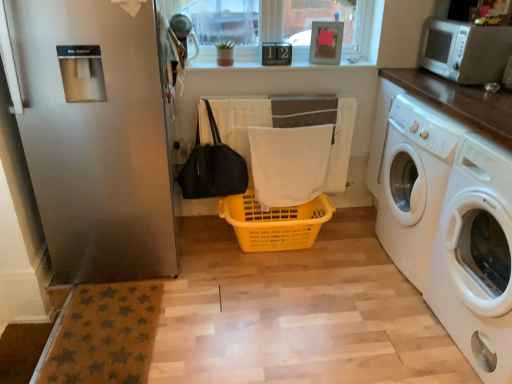
Question: Is black fabric bag at lower left at the left side of white glossy washing machine at right, arranged as the second washing machine when viewed from the back?

Choices:
 (A) no
 (B) yes

Answer: (B)

Question: Considering the relative sizes of black fabric bag at lower left and white glossy washing machine at right, the 1th washing machine positioned from the front, in the image provided, is black fabric bag at lower left smaller than white glossy washing machine at right, the 1th washing machine positioned from the front,?

Choices:
 (A) yes
 (B) no

Answer: (A)

Question: From the image's perspective, is black fabric bag at lower left on top of white glossy washing machine at right, arranged as the second washing machine when viewed from the back?

Choices:
 (A) no
 (B) yes

Answer: (B)

Question: Does black fabric bag at lower left touch white glossy washing machine at right, arranged as the second washing machine when viewed from the back?

Choices:
 (A) no
 (B) yes

Answer: (A)

Question: Considering the relative positions of black fabric bag at lower left and white glossy washing machine at right, arranged as the second washing machine when viewed from the back, in the image provided, is black fabric bag at lower left in front of white glossy washing machine at right, arranged as the second washing machine when viewed from the back,?

Choices:
 (A) no
 (B) yes

Answer: (A)

Question: Considering the relative sizes of black fabric bag at lower left and white glossy washing machine at right, the 1th washing machine positioned from the front, in the image provided, is black fabric bag at lower left bigger than white glossy washing machine at right, the 1th washing machine positioned from the front,?

Choices:
 (A) no
 (B) yes

Answer: (A)

Question: Would you say yellow plastic basket at center is part of black fabric bag at lower left's contents?

Choices:
 (A) no
 (B) yes

Answer: (A)

Question: Considering the relative sizes of black fabric bag at lower left and yellow plastic basket at center in the image provided, is black fabric bag at lower left smaller than yellow plastic basket at center?

Choices:
 (A) yes
 (B) no

Answer: (A)

Question: Does black fabric bag at lower left turn towards yellow plastic basket at center?

Choices:
 (A) yes
 (B) no

Answer: (B)

Question: Considering the relative sizes of black fabric bag at lower left and yellow plastic basket at center in the image provided, is black fabric bag at lower left wider than yellow plastic basket at center?

Choices:
 (A) no
 (B) yes

Answer: (A)

Question: Is black fabric bag at lower left thinner than yellow plastic basket at center?

Choices:
 (A) no
 (B) yes

Answer: (B)

Question: Is black fabric bag at lower left directly adjacent to yellow plastic basket at center?

Choices:
 (A) no
 (B) yes

Answer: (A)

Question: Does white glossy washing machine at right, which is the second washing machine in front-to-back order, come behind black fabric bag at lower left?

Choices:
 (A) yes
 (B) no

Answer: (B)